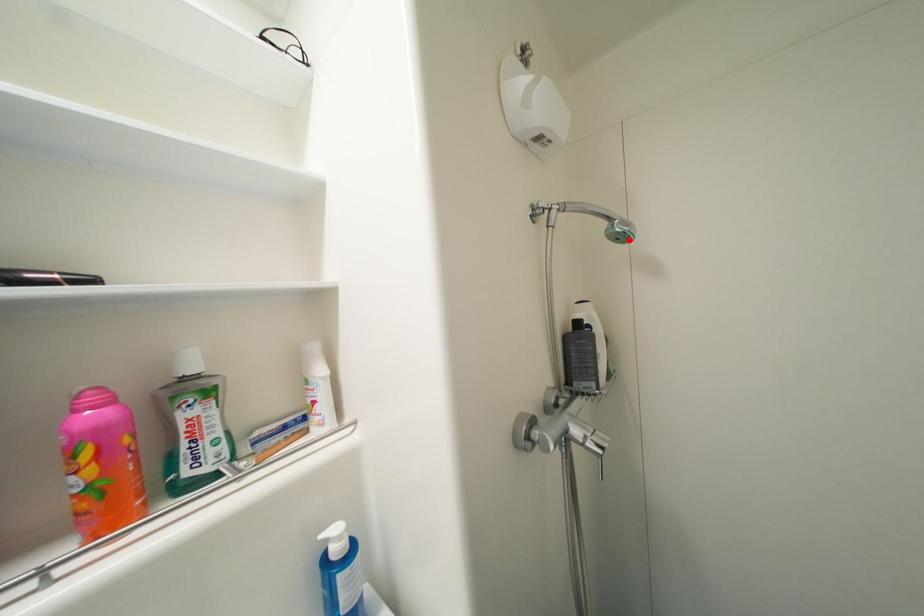
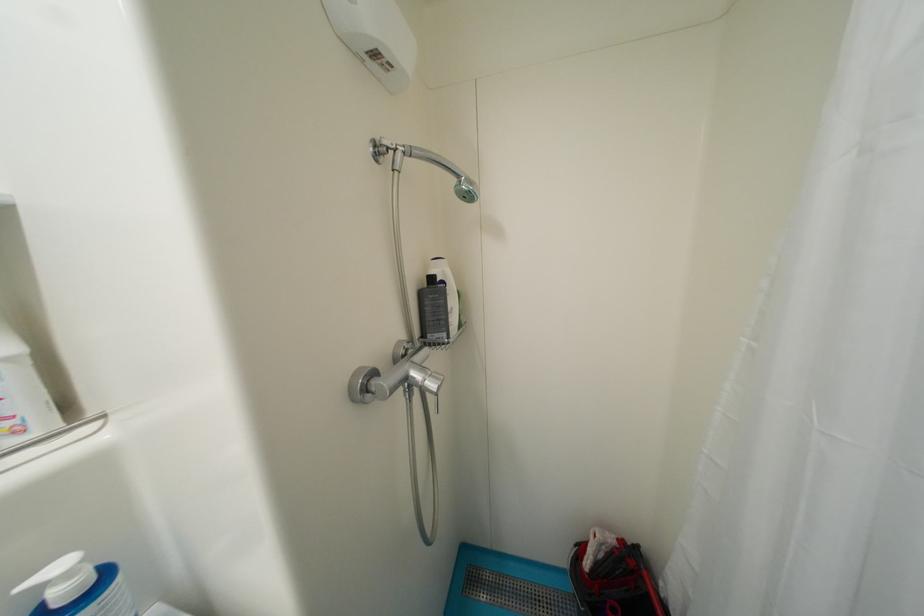
Find the pixel in the second image that matches the highlighted location in the first image.

(476, 199)